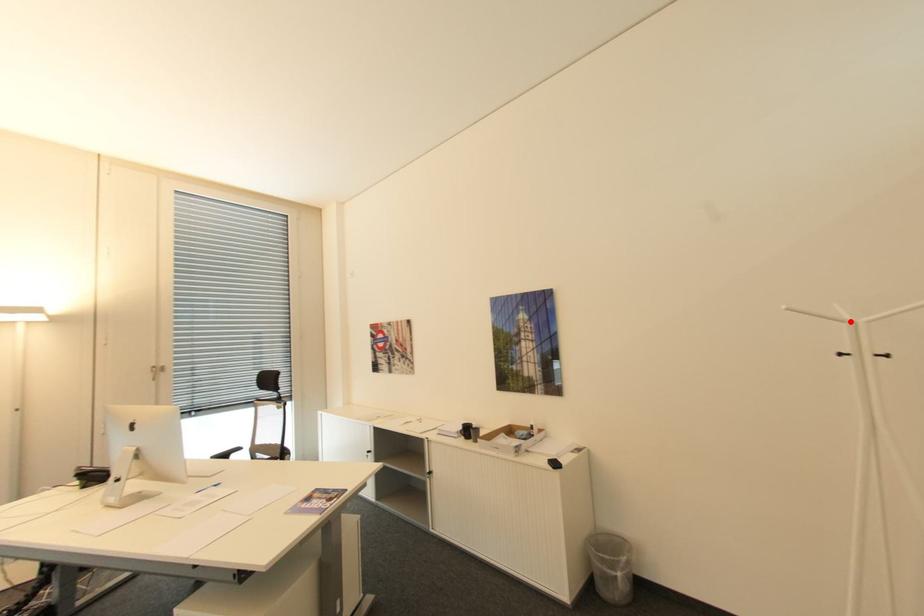
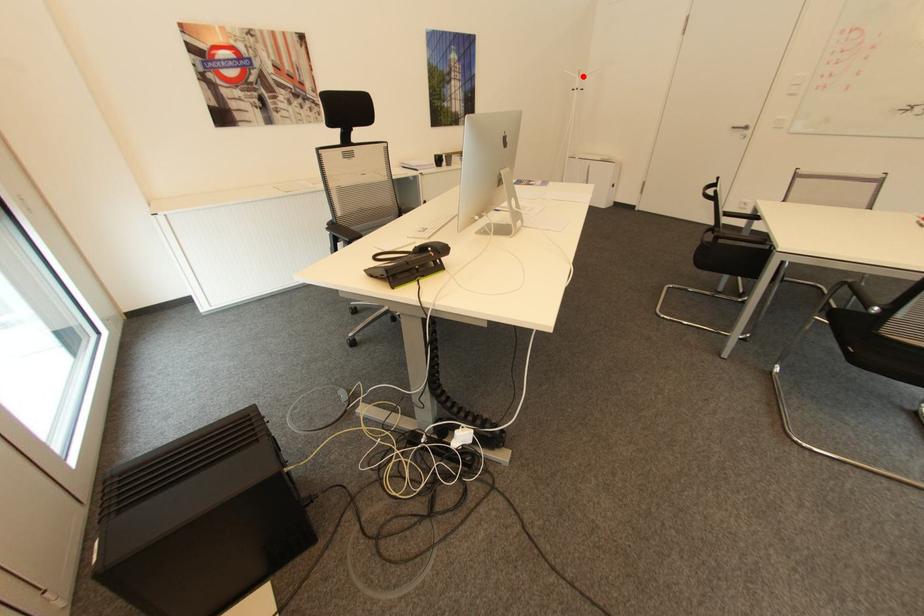
I am providing you with two images of the same scene from different viewpoints. A red point is marked on the first image and another point is marked on the second image. Does the point marked in image1 correspond to the same location as the one in image2?

Yes